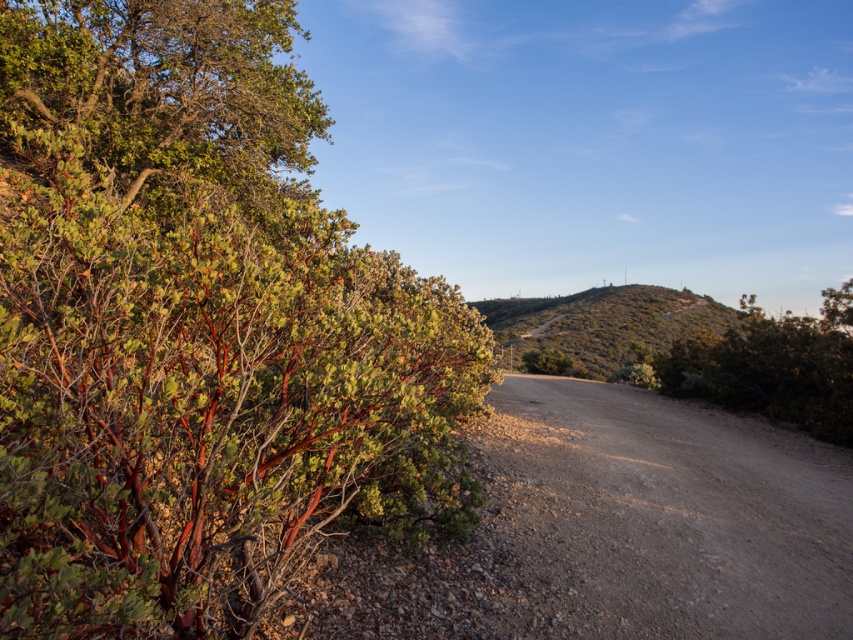
Who is more distant from viewer, (183,518) or (622,323)?

The point (622,323) is more distant.

Is point (316, 364) positioned after point (590, 323)?

That is False.

Where is `matte reddish-brown shrub at left`? matte reddish-brown shrub at left is located at coordinates (196, 330).

Can you confirm if green shrubbery at center is positioned to the right of green matte bush at center?

Yes, green shrubbery at center is to the right of green matte bush at center.

Is the position of green shrubbery at center less distant than that of green matte bush at center?

Yes, it is in front of green matte bush at center.

Is point (498, 326) more distant than point (544, 355)?

Yes, it is.

You are a GUI agent. You are given a task and a screenshot of the screen. Output one action in this format:
    pyautogui.click(x=<x>, y=<y>)
    Task: Click on the green shrubbery at center
    The image size is (853, 640).
    Given the screenshot: What is the action you would take?
    pyautogui.click(x=602, y=323)

Who is positioned more to the right, matte reddish-brown shrub at left or green matte bush at center?

green matte bush at center

Can you confirm if matte reddish-brown shrub at left is positioned to the right of green matte bush at center?

No, matte reddish-brown shrub at left is not to the right of green matte bush at center.

Between point (171, 282) and point (570, 362), which one is positioned in front?

Positioned in front is point (171, 282).

Locate an element on the screen. The height and width of the screenshot is (640, 853). matte reddish-brown shrub at left is located at coordinates (196, 330).